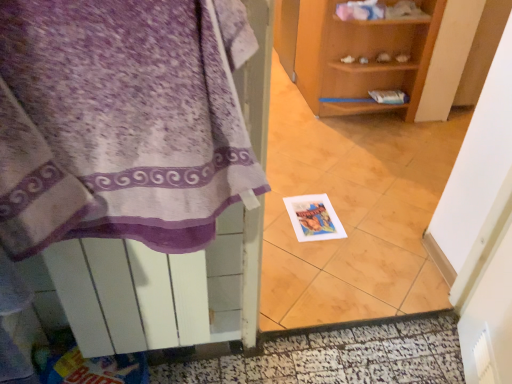
At what (x,y) coordinates should I click in order to perform the action: click on free area below white glossy tile at center (from a real-world perspective). Please return your answer as a coordinate pair (x, y). Looking at the image, I should click on (368, 337).